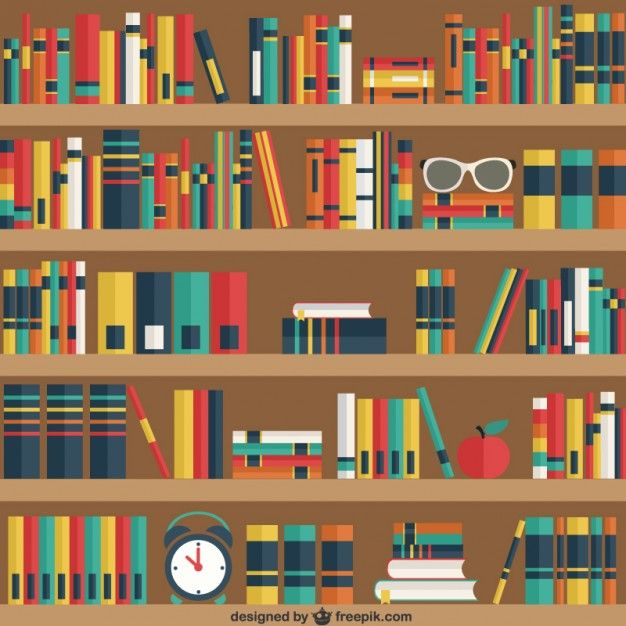
Find the location of a particular element. Image resolution: width=626 pixels, height=626 pixels. books leaning sideways a little is located at coordinates coord(213,77), coord(269,162), coord(501,339), coord(499,327), coord(496,313), coord(495,300), coord(428,422), coord(154,439), coord(498,590).